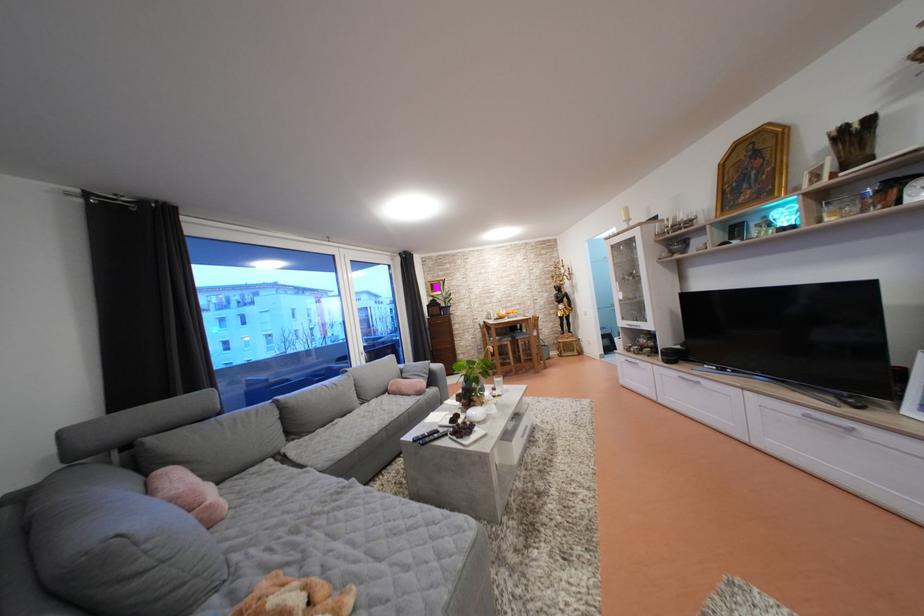
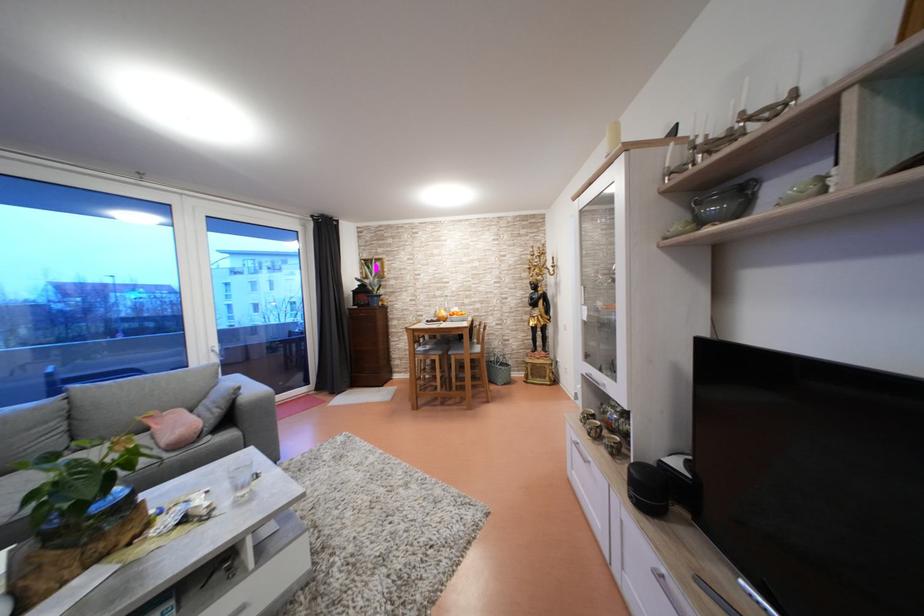
Where in the second image is the point corresponding to pixel 494 306 from the first image?

(444, 299)